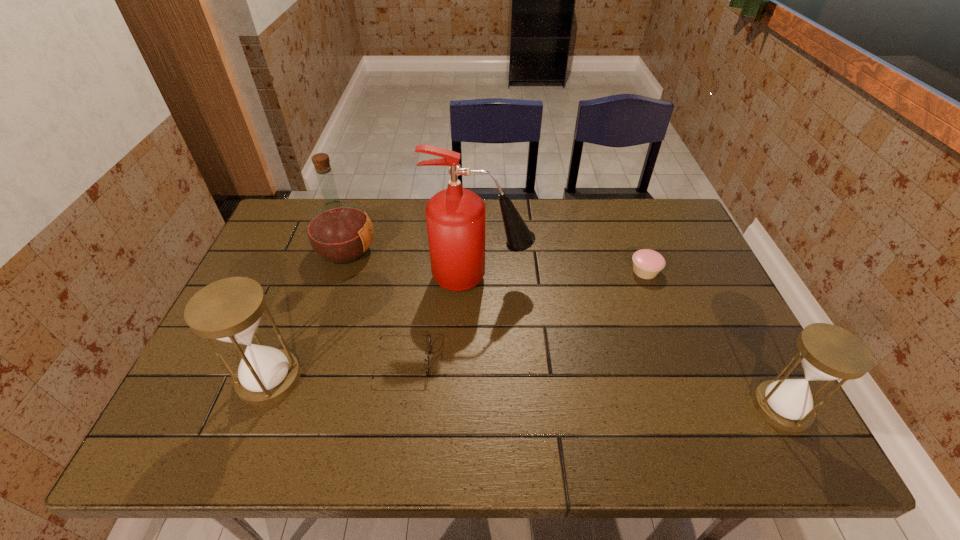
To ensure equal spacing by inserting another hourglass among them, please point out a vacant spot for this new hourglass. Please provide its 2D coordinates. Your answer should be formatted as a tuple, i.e. [(x, y)], where the tuple contains the x and y coordinates of a point satisfying the conditions above.

[(519, 393)]